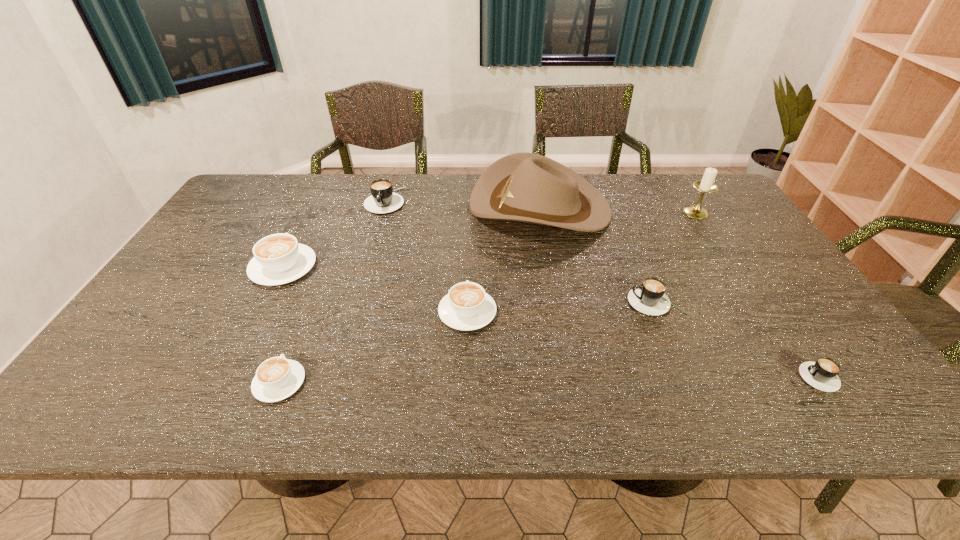
You are a GUI agent. You are given a task and a screenshot of the screen. Output one action in this format:
    pyautogui.click(x=<x>, y=<y>)
    Task: Click on the free location located with the handle on the side of the rightmost black cappuccino
    The image size is (960, 540).
    Given the screenshot: What is the action you would take?
    pyautogui.click(x=763, y=377)

Image resolution: width=960 pixels, height=540 pixels. I want to click on vacant region located 0.050m with the handle on the side of the rightmost black cappuccino, so click(778, 377).

At what (x,y) coordinates should I click in order to perform the action: click on cowboy hat that is at the far edge. Please return your answer as a coordinate pair (x, y). Looking at the image, I should click on (525, 187).

You are a GUI agent. You are given a task and a screenshot of the screen. Output one action in this format:
    pyautogui.click(x=<x>, y=<y>)
    Task: Click on the candle holder positioned at the far edge
    
    Given the screenshot: What is the action you would take?
    point(706,185)

The height and width of the screenshot is (540, 960). In order to click on cappuccino that is at the far edge in this screenshot , I will do `click(383, 200)`.

Identify the location of candle holder at the right edge. (706, 185).

Identify the location of cappuccino that is at the right edge. The image size is (960, 540). tap(822, 374).

Where is `object that is at the far right corner`? object that is at the far right corner is located at coordinates (706, 185).

Identify the location of object that is positioned at the near right corner. Image resolution: width=960 pixels, height=540 pixels. (822, 374).

Locate an element on the screen. This screenshot has width=960, height=540. free location at the far edge of the desktop is located at coordinates (616, 210).